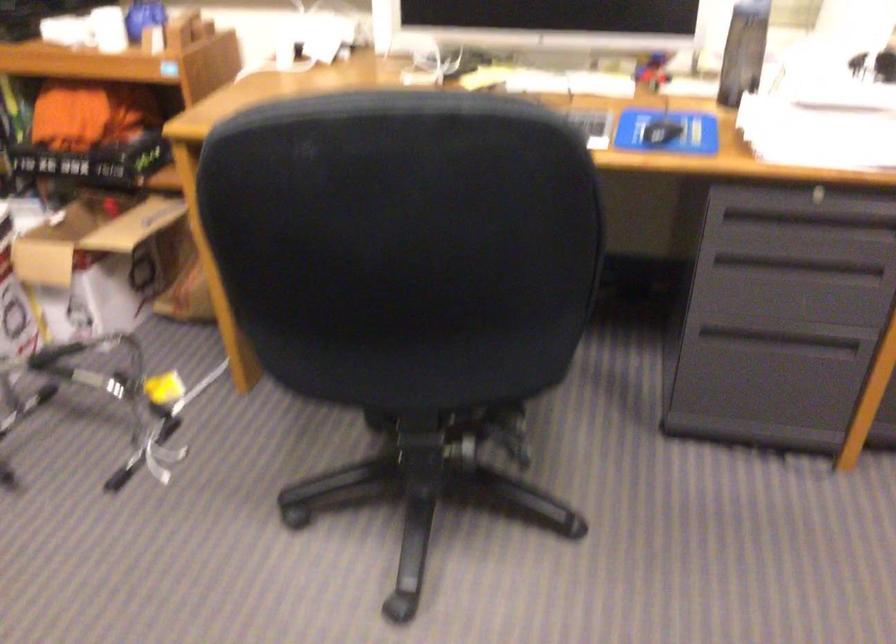
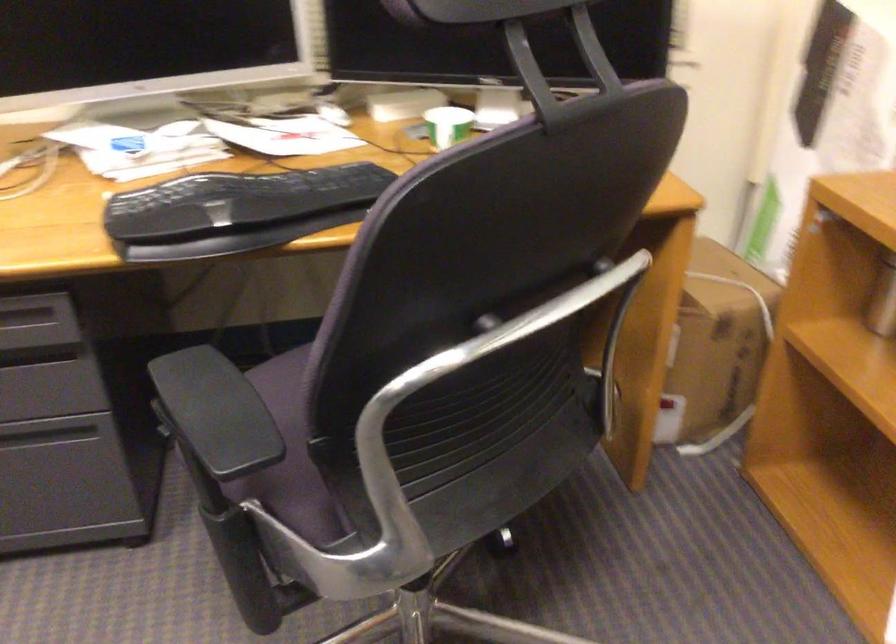
Question: Which direction would the cameraman need to move to produce the second image? Reply with the corresponding letter.

Choices:
 (A) Left
 (B) Right
 (C) Forward
 (D) Backward

Answer: (B)